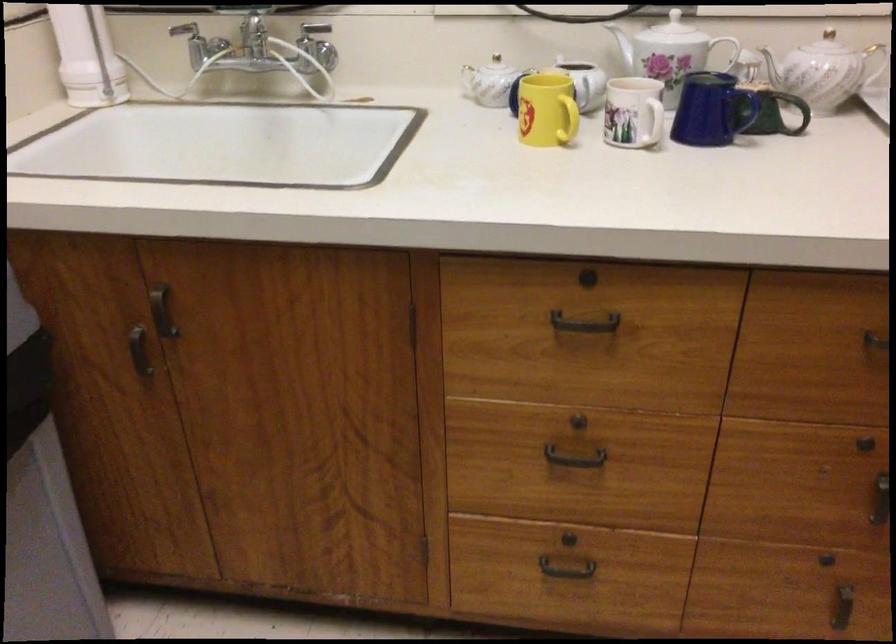
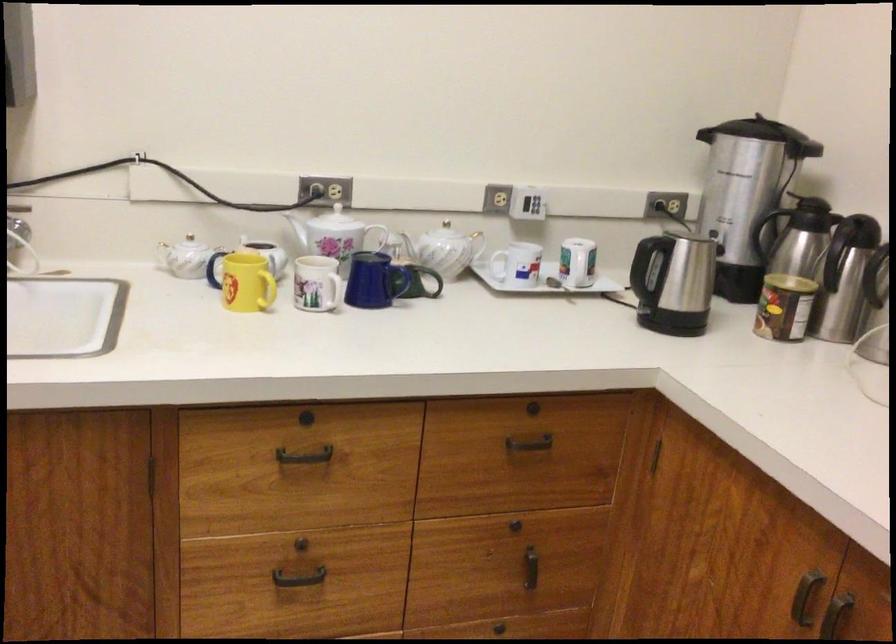
The point at [774,109] is marked in the first image. Where is the corresponding point in the second image?

(420, 281)